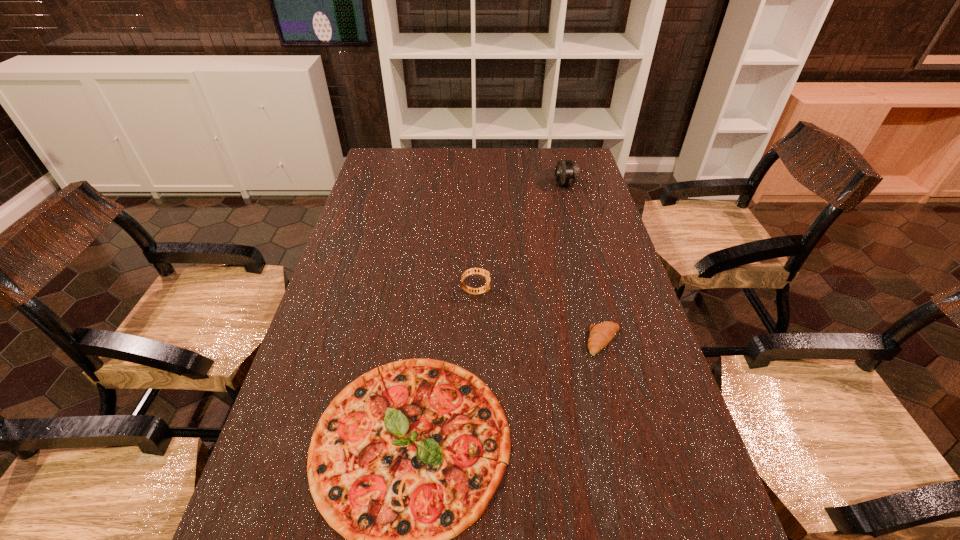
You are a GUI agent. You are given a task and a screenshot of the screen. Output one action in this format:
    pyautogui.click(x=<x>, y=<y>)
    Task: Click on the vacant area situated 0.050m on the left of the second nearest object
    This screenshot has height=540, width=960.
    Given the screenshot: What is the action you would take?
    pyautogui.click(x=566, y=341)

Locate an element on the screen. The height and width of the screenshot is (540, 960). telephoto lens situated at the right edge is located at coordinates (567, 172).

The height and width of the screenshot is (540, 960). Identify the location of crescent roll that is at the right edge. (601, 334).

Locate an element on the screen. free space at the far edge of the desktop is located at coordinates (434, 158).

Identify the location of free spot at the left edge of the desktop. (348, 256).

The height and width of the screenshot is (540, 960). What are the coordinates of `vacant space at the right edge of the desktop` in the screenshot? It's located at (586, 246).

At what (x,y) coordinates should I click in order to perform the action: click on free space at the far left corner of the desktop. Please return your answer as a coordinate pair (x, y). The image size is (960, 540). Looking at the image, I should click on (382, 161).

The width and height of the screenshot is (960, 540). In order to click on vacant point at the far right corner in this screenshot , I will do `click(562, 153)`.

Identify the location of free space between the farthest object and the second shortest object. (585, 263).

Identify the location of vacant space in between the tallest object and the third tallest object. (585, 263).